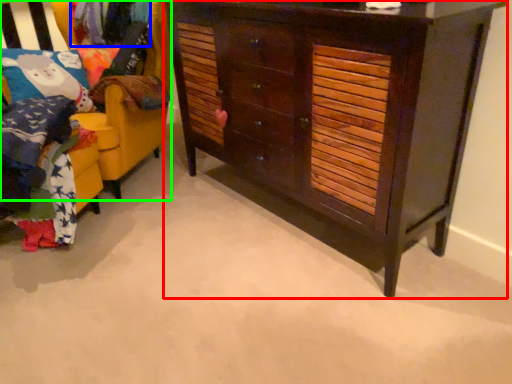
Question: Estimate the real-world distances between objects in this image. Which object is farther from chest of drawers (highlighted by a red box), clothing (highlighted by a blue box) or furniture (highlighted by a green box)?

Choices:
 (A) clothing
 (B) furniture

Answer: (A)